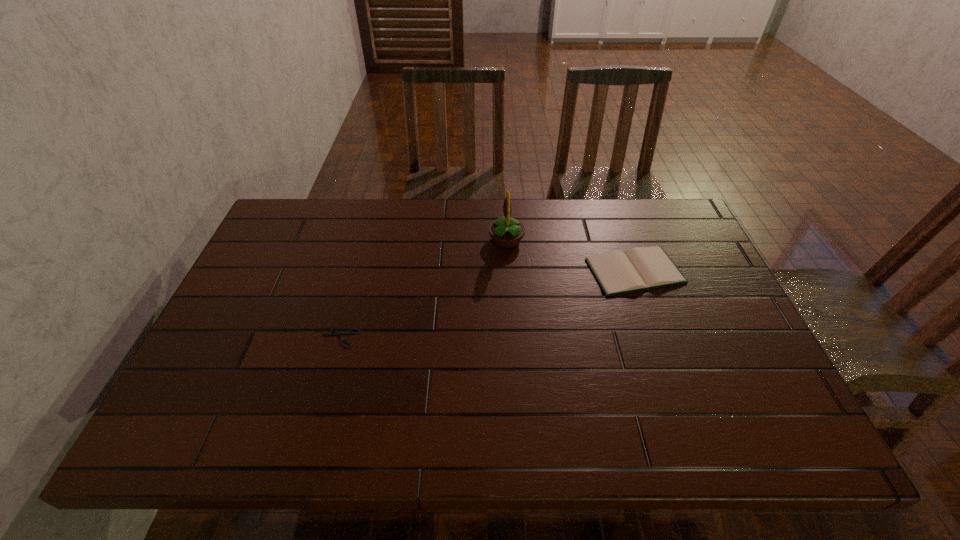
This screenshot has width=960, height=540. In order to click on the second object from right to left in this screenshot , I will do `click(506, 232)`.

You are a GUI agent. You are given a task and a screenshot of the screen. Output one action in this format:
    pyautogui.click(x=<x>, y=<y>)
    Task: Click on the sunflower
    The width and height of the screenshot is (960, 540).
    Given the screenshot: What is the action you would take?
    click(x=506, y=232)

At what (x,y) coordinates should I click in order to perform the action: click on hardback book. Please return your answer as a coordinate pair (x, y). The width and height of the screenshot is (960, 540). Looking at the image, I should click on (641, 268).

Identify the location of the second tallest object. This screenshot has height=540, width=960. (641, 268).

The image size is (960, 540). In order to click on the leftmost object in this screenshot , I will do `click(347, 332)`.

At what (x,y) coordinates should I click in order to perform the action: click on the shortest object. Please return your answer as a coordinate pair (x, y). The image size is (960, 540). Looking at the image, I should click on (347, 332).

Identify the location of free space located on the face of the second object from right to left. (368, 240).

Find the location of a particular element. The width and height of the screenshot is (960, 540). vacant space located on the face of the second object from right to left is located at coordinates (358, 240).

At what (x,y) coordinates should I click in order to perform the action: click on vacant space situated on the face of the second object from right to left. Please return your answer as a coordinate pair (x, y). Looking at the image, I should click on (426, 240).

Locate an element on the screen. Image resolution: width=960 pixels, height=540 pixels. vacant area located 0.390m on the left of the rightmost object is located at coordinates pos(450,271).